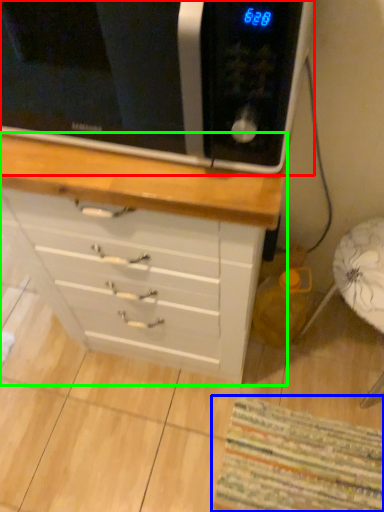
Question: Based on their relative distances, which object is farther from microwave oven (highlighted by a red box)? Choose from mat (highlighted by a blue box) and chest of drawers (highlighted by a green box).

Choices:
 (A) mat
 (B) chest of drawers

Answer: (A)